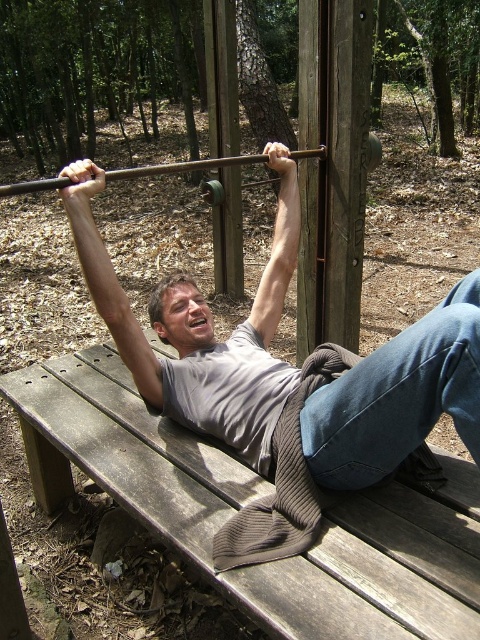
You are an athlete preparing to do pull ups. You have a gray matte shirt at center and a wooden barbell at center in front of you. Which object is narrower?

The gray matte shirt at center is narrower than the wooden barbell at center.

You are a fitness trainer observing a client doing pull ups on the wooden bench at center and gray matte shirt at center. The client wants to know if they can safely place a 12 inch water bottle on the bench without it falling off. Can they?

The distance between the wooden bench at center and gray matte shirt at center is 12.71 inches. Since the water bottle is 12 inches, which is shorter than the distance, it should fit and not fall off.

From the picture: You are standing in a wooded area and see a wooden structure where a man is doing pull ups. You want to place a small stool at a point exactly 6 feet away from where you are standing. Can you place it at point [271,317]?

The distance of point [271,317] from viewer is 6.51 feet, so the stool placed there would be 6.51 feet away, which is slightly further than the desired 6 feet. You might need to move it closer by about 0.51 feet to meet the requirement.